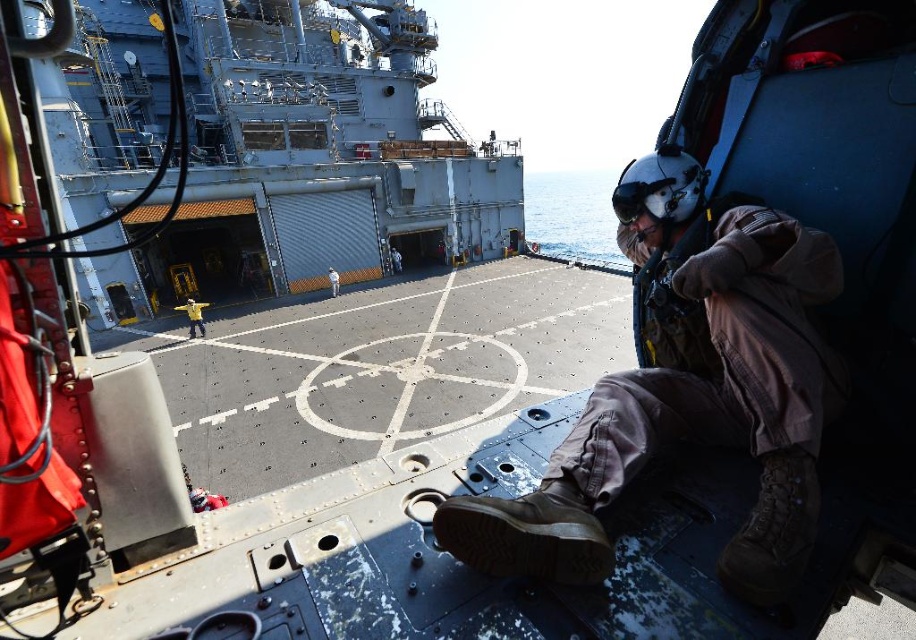
In the scene shown: You are a crew member in the helicopter and need to jump onto the gray metallic boat at center. Given that the safe jump distance is 30 feet, is this jump feasible?

The gray metallic boat at center is 32.11 feet away from the viewer. Since the safe jump distance is 30 feet, the jump is not feasible as it exceeds the safe distance by 2.11 feet.

You are a crew member on the naval ship and you see the brown fabric helmet at upper center and the light blue uniform at center from your vantage point. Which object is positioned lower in the scene?

The brown fabric helmet at upper center is located below the light blue uniform at center, so the brown fabric helmet at upper center is positioned lower in the scene.

Looking at this image, based on the scene described, where is the gray metallic boat at center located relative to the brown fabric helmet at upper center?

The gray metallic boat at center is located to the left of the brown fabric helmet at upper center.